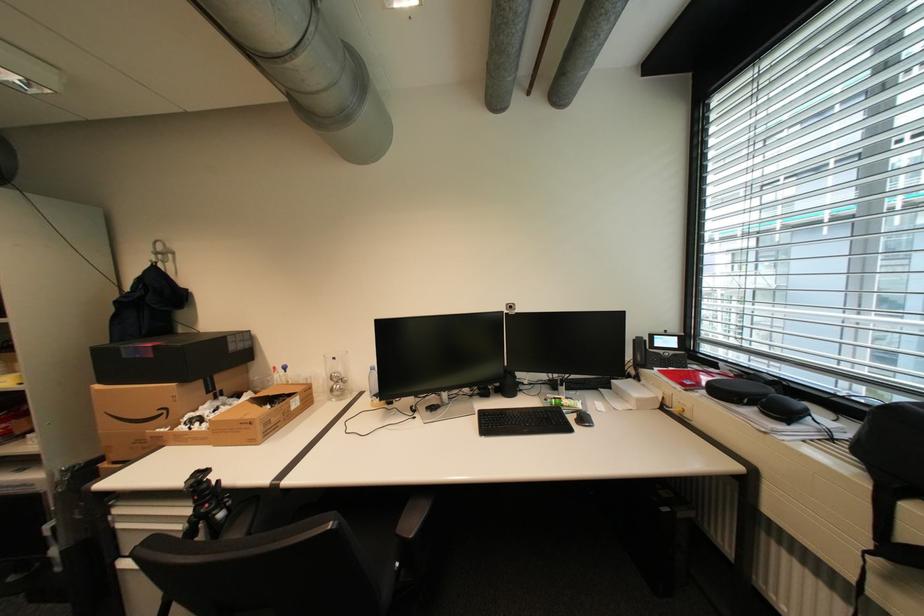
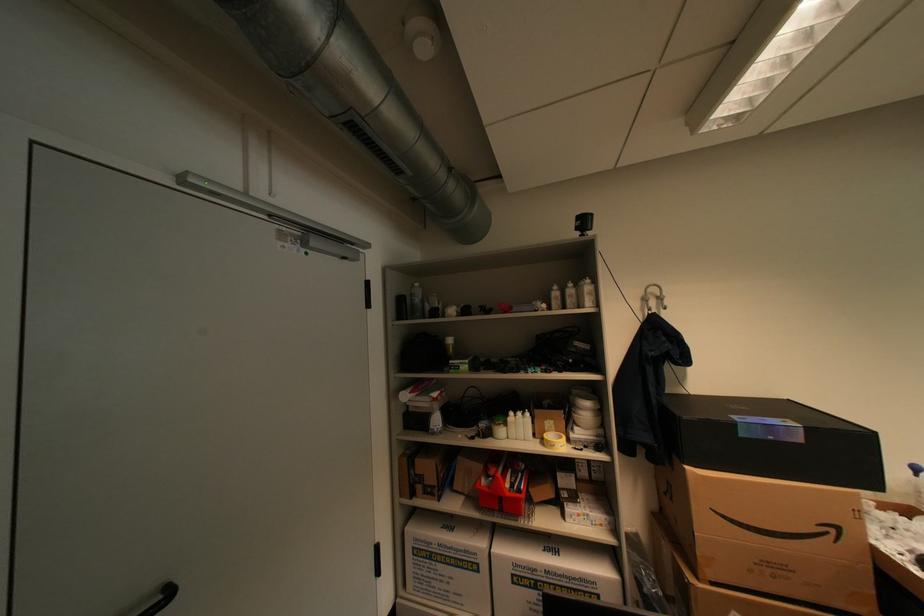
The point at (174, 411) is marked in the first image. Where is the corresponding point in the second image?

(841, 531)